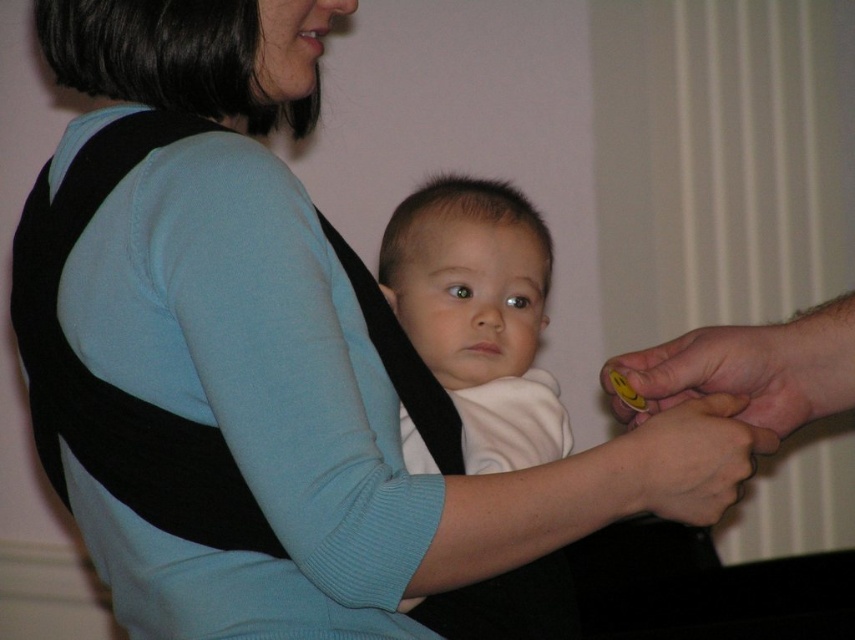
Who is positioned more to the right, white soft baby at center or yellow rubber ring at right?

yellow rubber ring at right

Can you confirm if white soft baby at center is positioned to the right of yellow rubber ring at right?

In fact, white soft baby at center is to the left of yellow rubber ring at right.

Which is in front, point (445, 596) or point (770, 349)?

Point (445, 596) is more forward.

At what (x,y) coordinates should I click in order to perform the action: click on white soft baby at center. Please return your answer as a coordinate pair (x, y). This screenshot has height=640, width=855. Looking at the image, I should click on (478, 314).

Does yellow rubber ring at right appear on the left side of smooth skin hand at lower right?

In fact, yellow rubber ring at right is to the right of smooth skin hand at lower right.

Who is taller, yellow rubber ring at right or smooth skin hand at lower right?

Standing taller between the two is smooth skin hand at lower right.

You are a GUI agent. You are given a task and a screenshot of the screen. Output one action in this format:
    pyautogui.click(x=<x>, y=<y>)
    Task: Click on the yellow rubber ring at right
    This screenshot has height=640, width=855.
    Given the screenshot: What is the action you would take?
    pyautogui.click(x=736, y=371)

Image resolution: width=855 pixels, height=640 pixels. I want to click on yellow rubber ring at right, so click(x=736, y=371).

Does white soft baby at center have a lesser height compared to smooth skin hand at lower right?

No, white soft baby at center is not shorter than smooth skin hand at lower right.

Does white soft baby at center appear over smooth skin hand at lower right?

Correct, white soft baby at center is located above smooth skin hand at lower right.

At what (x,y) coordinates should I click in order to perform the action: click on white soft baby at center. Please return your answer as a coordinate pair (x, y). The height and width of the screenshot is (640, 855). Looking at the image, I should click on (478, 314).

Identify the location of white soft baby at center. The image size is (855, 640). (478, 314).